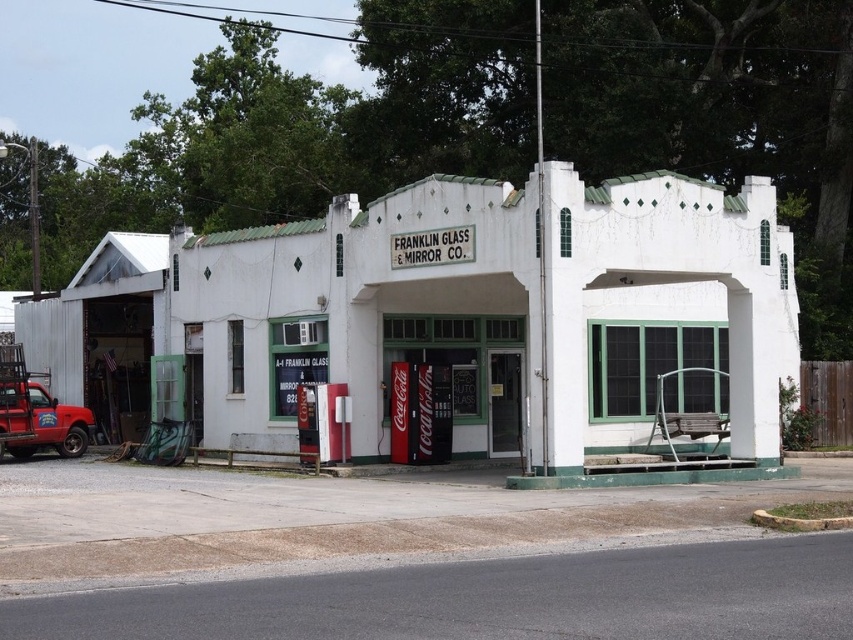
You are standing in front of the white painted building at center and the matte red truck at left. Which object is taller?

The white painted building at center is much taller than the matte red truck at left.